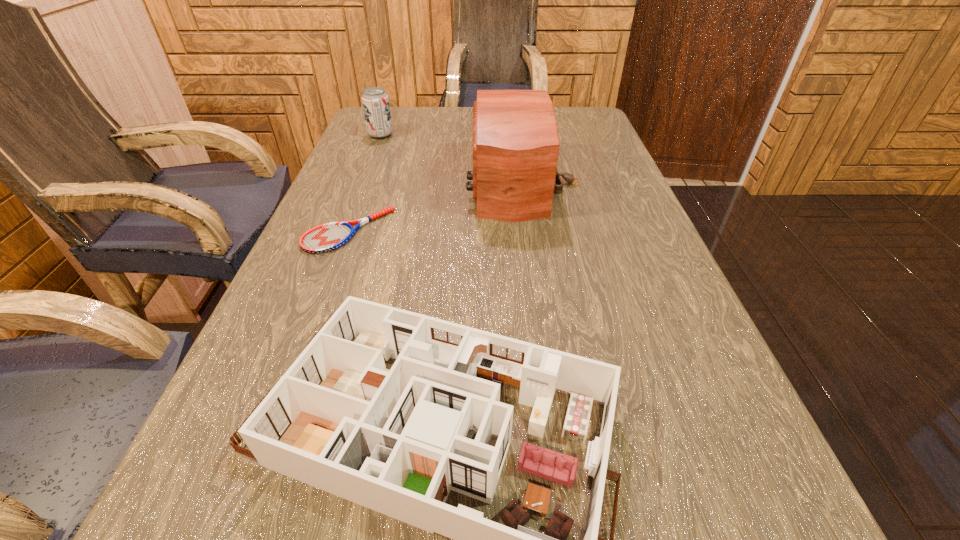
Where is `object that ranks as the third closest to the farthest object`? Image resolution: width=960 pixels, height=540 pixels. object that ranks as the third closest to the farthest object is located at coordinates (396, 441).

Locate which object is the closest to the farthest object. Please provide its 2D coordinates. Your answer should be formatted as a tuple, i.e. [(x, y)], where the tuple contains the x and y coordinates of a point satisfying the conditions above.

[(515, 148)]